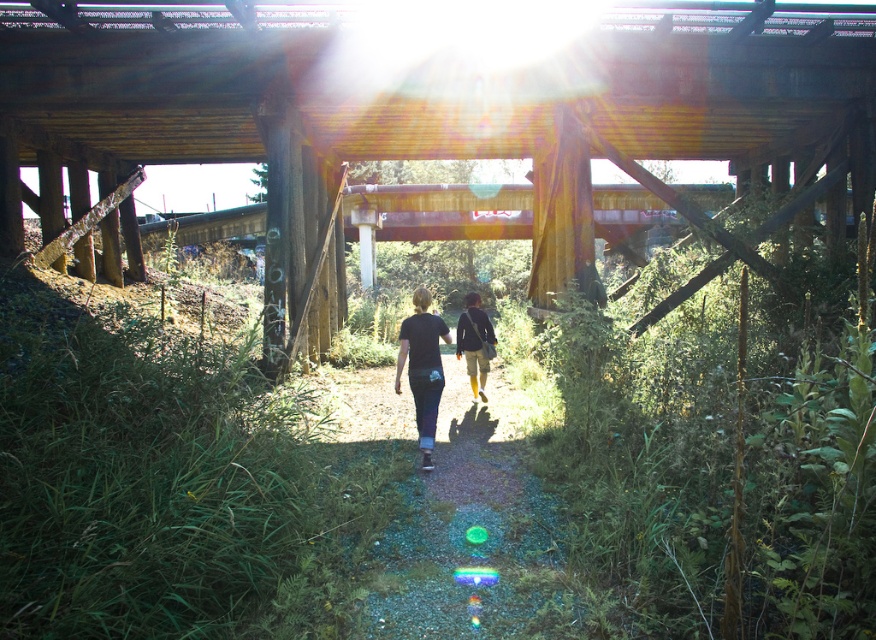
Does dirt path at center have a lesser width compared to yellow fabric pants at center?

Yes, dirt path at center is thinner than yellow fabric pants at center.

Can you confirm if dirt path at center is shorter than yellow fabric pants at center?

Correct, dirt path at center is not as tall as yellow fabric pants at center.

At what (x,y) coordinates should I click in order to perform the action: click on dirt path at center. Please return your answer as a coordinate pair (x, y). This screenshot has height=640, width=876. Looking at the image, I should click on (451, 515).

Is rusty metal bridge at center further to the viewer compared to yellow fabric pants at center?

No.

Can you confirm if rusty metal bridge at center is positioned to the right of yellow fabric pants at center?

In fact, rusty metal bridge at center is to the left of yellow fabric pants at center.

Locate an element on the screen. The width and height of the screenshot is (876, 640). rusty metal bridge at center is located at coordinates (435, 106).

I want to click on rusty metal bridge at center, so click(435, 106).

Is rusty metal bridge at center further to the viewer compared to dirt path at center?

Yes, it is.

Which is behind, point (580, 262) or point (484, 531)?

The point (580, 262) is behind.

Locate an element on the screen. rusty metal bridge at center is located at coordinates (435, 106).